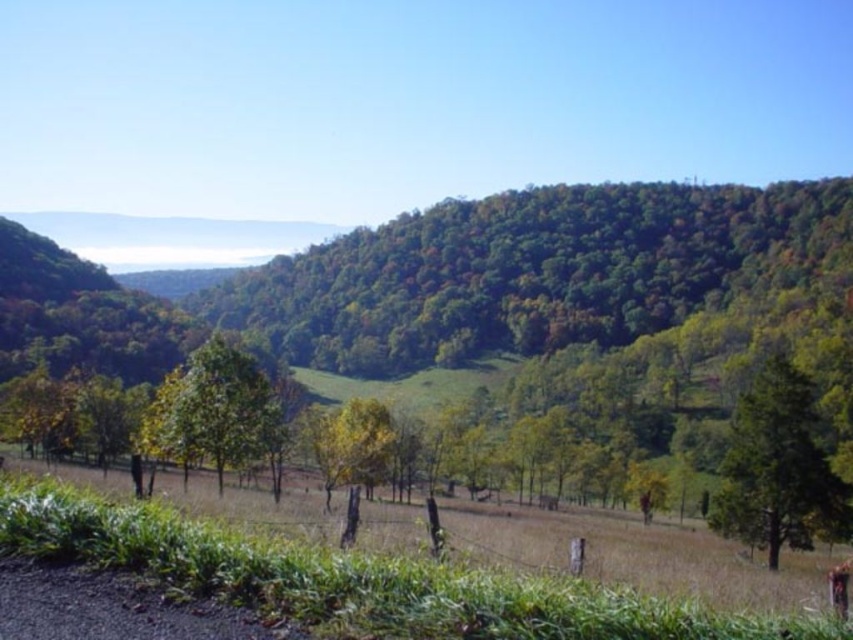
Question: Which point is closer to the camera?

Choices:
 (A) green leafy tree at center
 (B) green leafy tree at lower right

Answer: (B)

Question: Is green leafy tree at center below green leafy tree at lower right?

Choices:
 (A) yes
 (B) no

Answer: (B)

Question: Is green leafy tree at center below green leafy tree at lower right?

Choices:
 (A) no
 (B) yes

Answer: (A)

Question: Which of these objects is positioned closest to the green leafy tree at center?

Choices:
 (A) green matte tree at center
 (B) green leafy tree at lower right

Answer: (A)

Question: Can you confirm if green leafy tree at center is positioned above green matte tree at center?

Choices:
 (A) no
 (B) yes

Answer: (B)

Question: Among these points, which one is nearest to the camera?

Choices:
 (A) (53, 291)
 (B) (808, 419)
 (C) (177, 444)

Answer: (B)